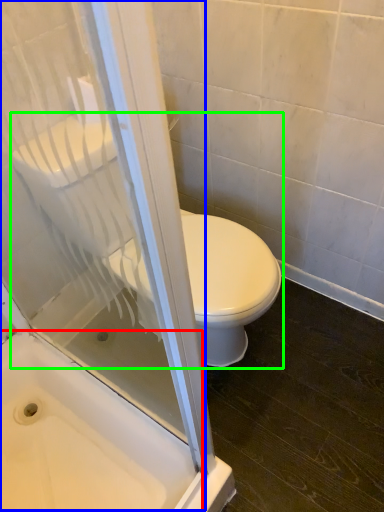
Question: Considering the real-world distances, which object is farthest from bath (highlighted by a red box)? screen door (highlighted by a blue box) or toilet (highlighted by a green box)?

Choices:
 (A) screen door
 (B) toilet

Answer: (B)